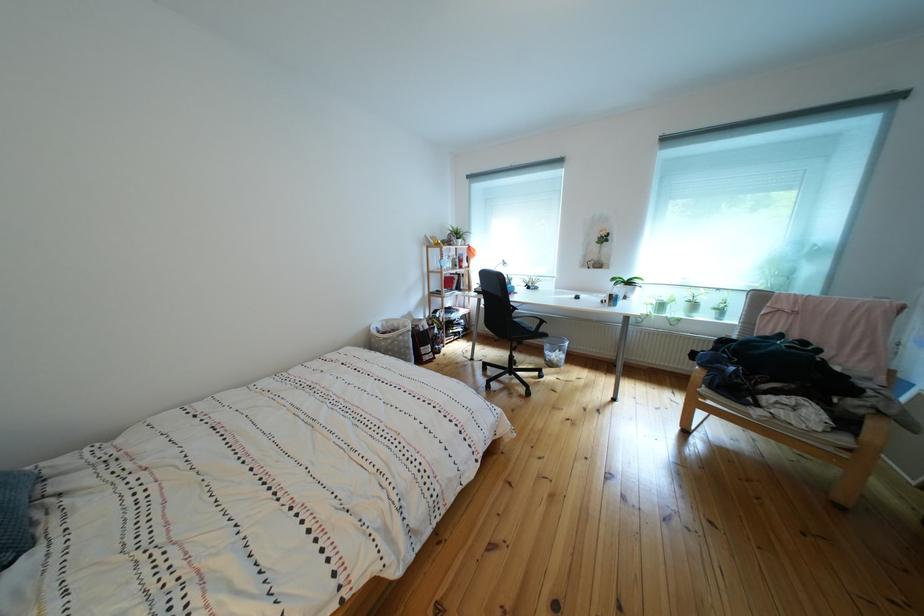
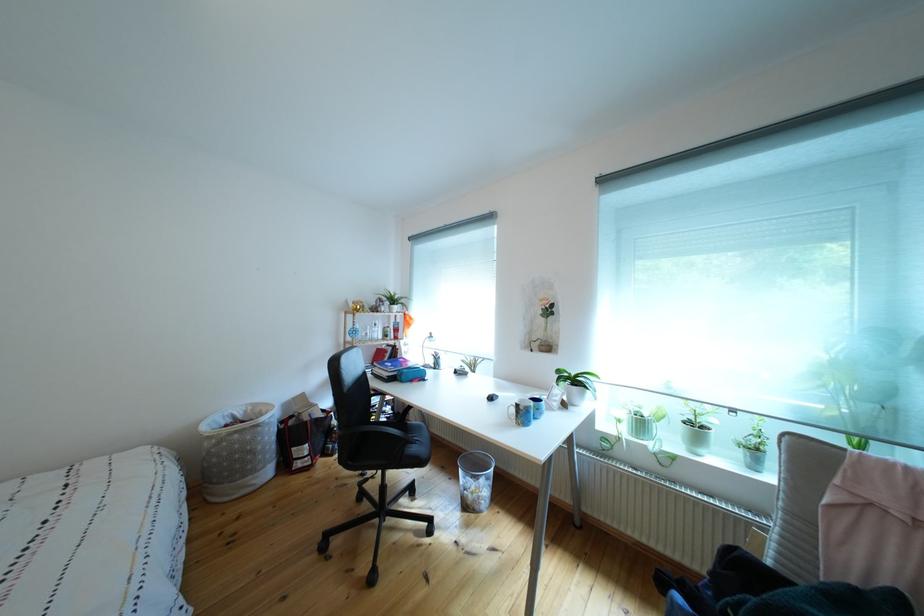
Where in the second image is the point corresponding to point (673, 312) from the first image?

(652, 430)